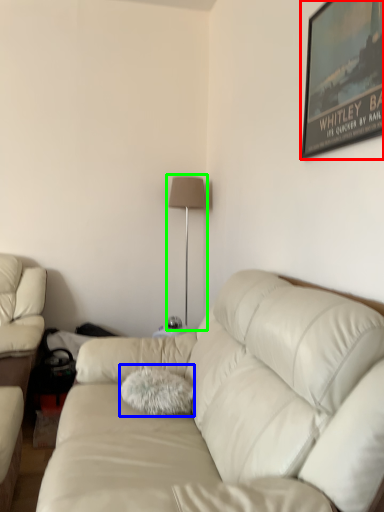
Question: Based on their relative distances, which object is farther from picture frame (highlighted by a red box)? Choose from throw pillow (highlighted by a blue box) and table lamp (highlighted by a green box).

Choices:
 (A) throw pillow
 (B) table lamp

Answer: (B)